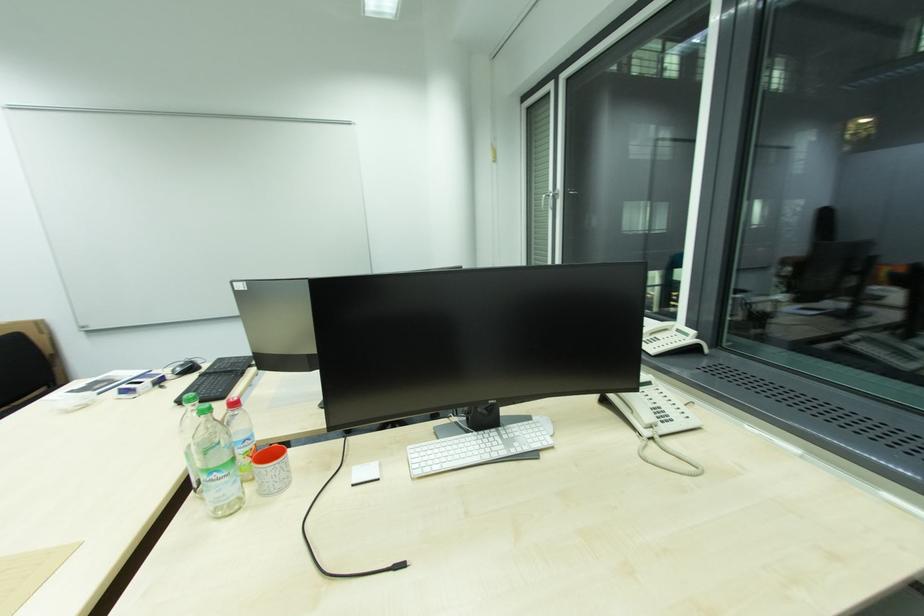
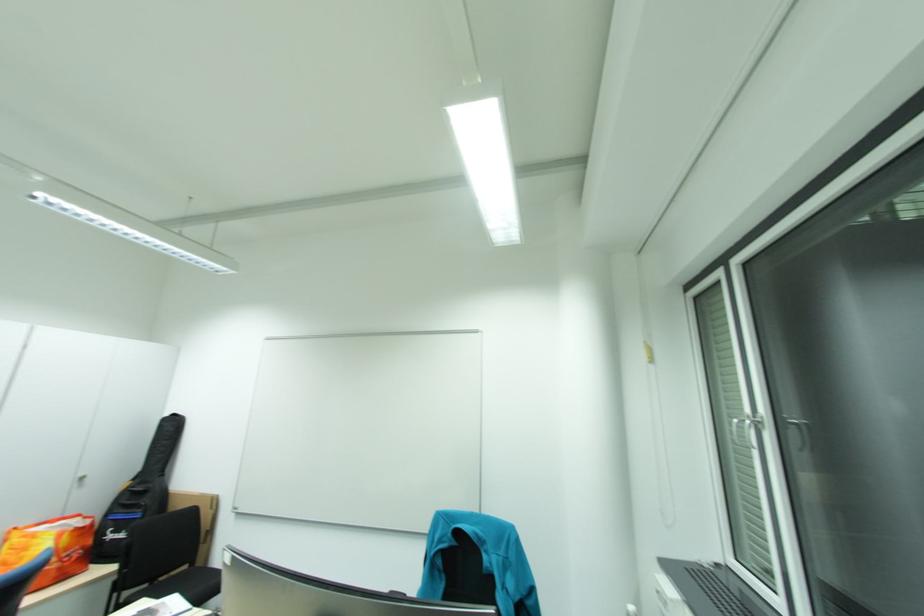
Locate, in the second image, the point that corresponds to [562,193] in the first image.

(755, 421)